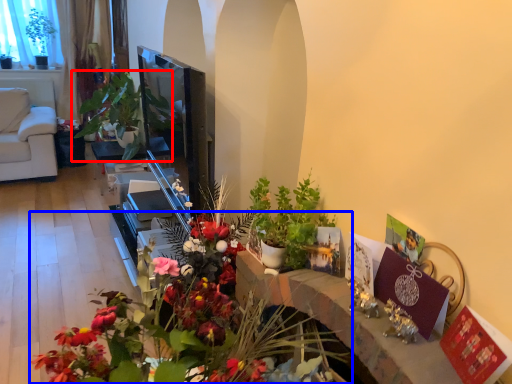
Question: Which object is further to the camera taking this photo, houseplant (highlighted by a red box) or flower (highlighted by a blue box)?

Choices:
 (A) houseplant
 (B) flower

Answer: (A)